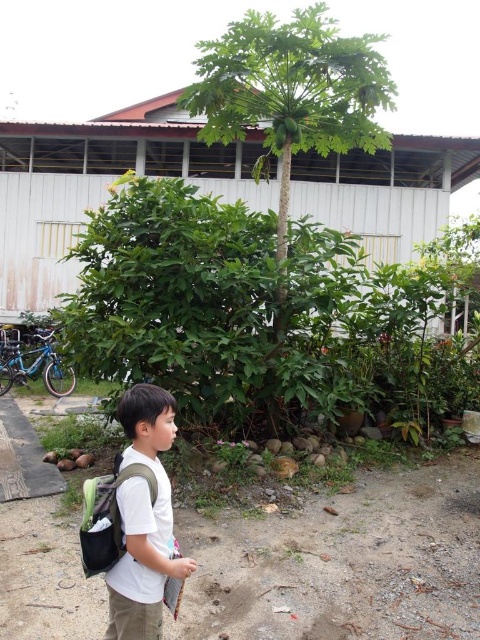
At what (x,y) coordinates should I click in order to perform the action: click on white matte shirt at lower left. Please return your answer as a coordinate pair (x, y). This screenshot has width=480, height=640. Looking at the image, I should click on (144, 518).

Is point (126, 397) closer to viewer compared to point (84, 572)?

Yes.

Image resolution: width=480 pixels, height=640 pixels. I want to click on white matte shirt at lower left, so click(144, 518).